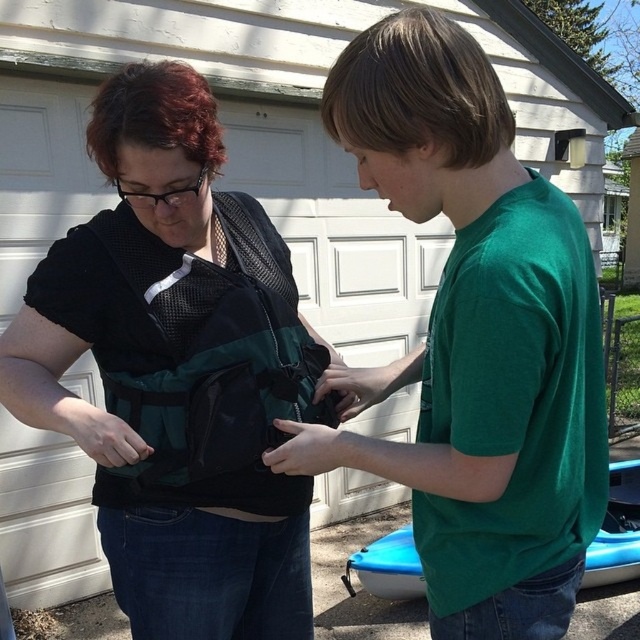
Is matte black vest at center to the right of blue plastic kayak at lower right from the viewer's perspective?

In fact, matte black vest at center is to the left of blue plastic kayak at lower right.

Which is below, matte black vest at center or blue plastic kayak at lower right?

blue plastic kayak at lower right is lower down.

Between point (227, 268) and point (621, 500), which one is positioned in front?

Point (227, 268) is more forward.

Locate an element on the screen. This screenshot has width=640, height=640. matte black vest at center is located at coordinates (177, 372).

Can you confirm if matte black vest at center is shorter than green matte shirt at center?

No, matte black vest at center is not shorter than green matte shirt at center.

Between matte black vest at center and green matte shirt at center, which one appears on the left side from the viewer's perspective?

From the viewer's perspective, matte black vest at center appears more on the left side.

Where is `matte black vest at center`? The width and height of the screenshot is (640, 640). matte black vest at center is located at coordinates (177, 372).

Can you confirm if green matte shirt at center is positioned to the left of blue plastic kayak at lower right?

Correct, you'll find green matte shirt at center to the left of blue plastic kayak at lower right.

Where is `green matte shirt at center`? This screenshot has height=640, width=640. green matte shirt at center is located at coordinates (474, 339).

Is point (563, 476) positioned after point (618, 486)?

No, (563, 476) is closer to viewer.

Locate an element on the screen. green matte shirt at center is located at coordinates (474, 339).